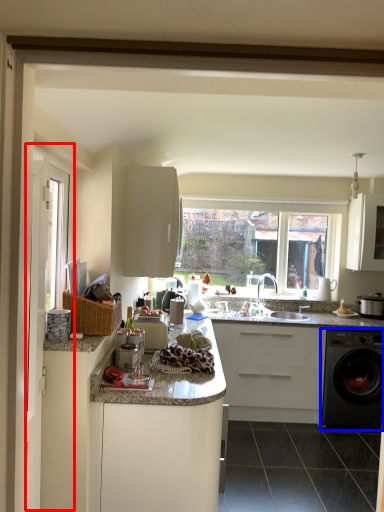
Question: Among these objects, which one is nearest to the camera, screen door (highlighted by a red box) or washing machine (highlighted by a blue box)?

Choices:
 (A) screen door
 (B) washing machine

Answer: (A)